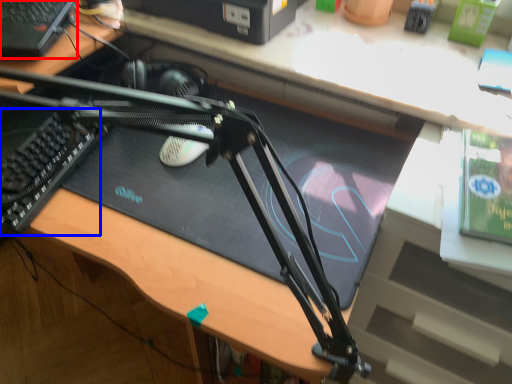
Question: Among these objects, which one is nearest to the camera, computer (highlighted by a red box) or laptop keyboard (highlighted by a blue box)?

Choices:
 (A) computer
 (B) laptop keyboard

Answer: (B)